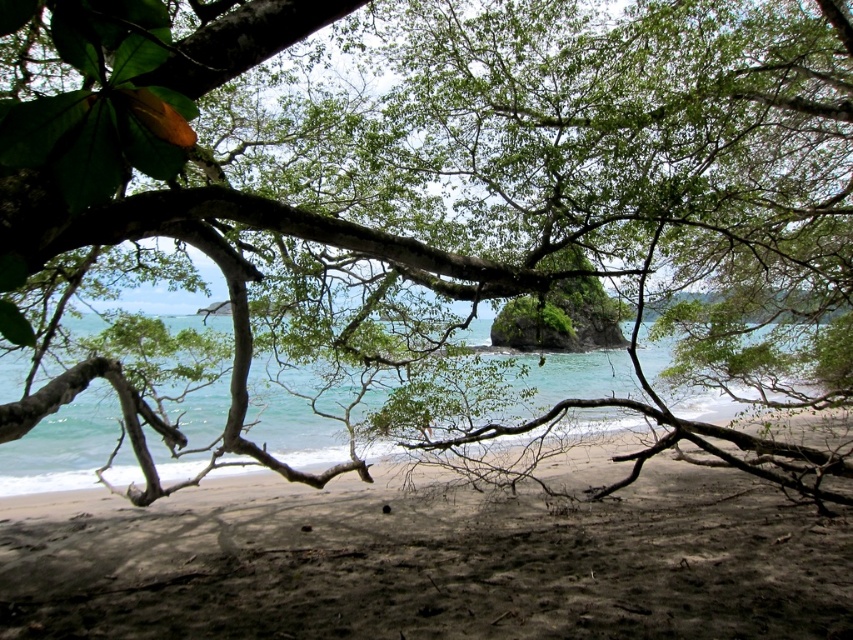
Question: Does dark brown sandy beach at center have a greater width compared to clear blue water at center?

Choices:
 (A) no
 (B) yes

Answer: (A)

Question: Does dark brown sandy beach at center have a smaller size compared to clear blue water at center?

Choices:
 (A) yes
 (B) no

Answer: (A)

Question: Is dark brown sandy beach at center positioned before clear blue water at center?

Choices:
 (A) no
 (B) yes

Answer: (B)

Question: Which object is closer to the camera taking this photo?

Choices:
 (A) clear blue water at center
 (B) dark brown sandy beach at center

Answer: (B)

Question: Which point is closer to the camera?

Choices:
 (A) dark brown sandy beach at center
 (B) clear blue water at center

Answer: (A)